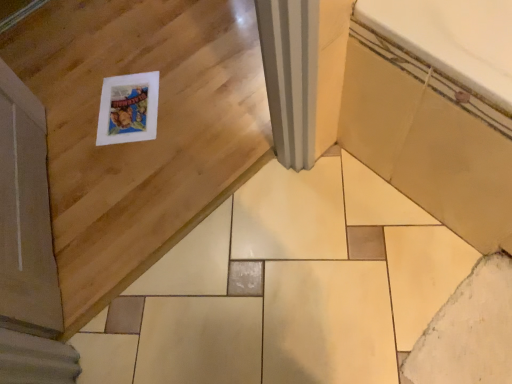
Question: Is the position of beige ceramic bathtub at lower right less distant than that of white matte ceramic tile at lower right?

Choices:
 (A) no
 (B) yes

Answer: (B)

Question: Can you confirm if beige ceramic bathtub at lower right is shorter than white matte ceramic tile at lower right?

Choices:
 (A) yes
 (B) no

Answer: (B)

Question: From a real-world perspective, does beige ceramic bathtub at lower right stand above white matte ceramic tile at lower right?

Choices:
 (A) no
 (B) yes

Answer: (B)

Question: Does beige ceramic bathtub at lower right have a larger size compared to white matte ceramic tile at lower right?

Choices:
 (A) yes
 (B) no

Answer: (A)

Question: Does beige ceramic bathtub at lower right have a greater width compared to white matte ceramic tile at lower right?

Choices:
 (A) yes
 (B) no

Answer: (A)

Question: Can we say beige ceramic bathtub at lower right lies outside white matte ceramic tile at lower right?

Choices:
 (A) yes
 (B) no

Answer: (A)

Question: Is white matte ceramic tile at lower right smaller than beige ceramic bathtub at lower right?

Choices:
 (A) no
 (B) yes

Answer: (B)

Question: Does white matte ceramic tile at lower right have a larger size compared to beige ceramic bathtub at lower right?

Choices:
 (A) yes
 (B) no

Answer: (B)

Question: Can you confirm if white matte ceramic tile at lower right is taller than beige ceramic bathtub at lower right?

Choices:
 (A) no
 (B) yes

Answer: (A)

Question: Would you say white matte ceramic tile at lower right is a long distance from beige ceramic bathtub at lower right?

Choices:
 (A) no
 (B) yes

Answer: (A)

Question: Is white matte ceramic tile at lower right to the left of beige ceramic bathtub at lower right from the viewer's perspective?

Choices:
 (A) no
 (B) yes

Answer: (B)

Question: Is beige ceramic bathtub at lower right surrounded by white matte ceramic tile at lower right?

Choices:
 (A) yes
 (B) no

Answer: (B)

Question: From the image's perspective, is beige ceramic bathtub at lower right above or below white matte ceramic tile at lower right?

Choices:
 (A) below
 (B) above

Answer: (B)